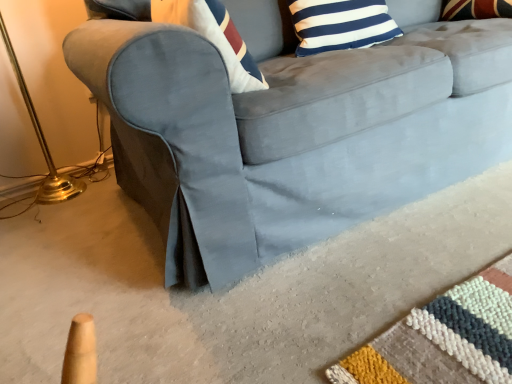
Locate an element on the screen. Image resolution: width=512 pixels, height=384 pixels. free space in front of gold metallic table lamp at left is located at coordinates (65, 236).